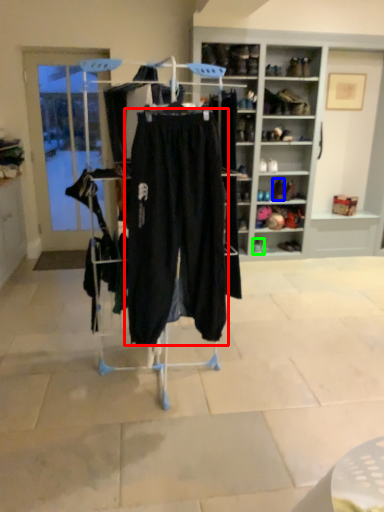
Question: Which object is the closest to the trousers (highlighted by a red box)? Choose among these: footwear (highlighted by a blue box) or footwear (highlighted by a green box).

Choices:
 (A) footwear
 (B) footwear

Answer: (B)